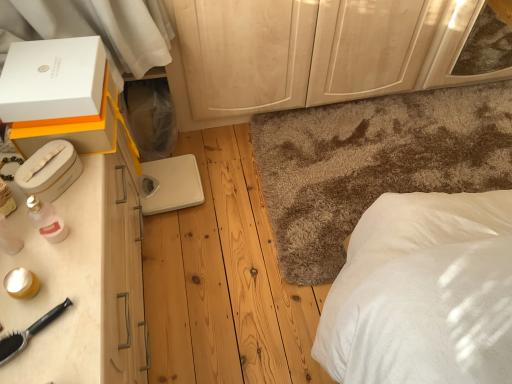
Question: Considering their positions, is white cardboard box at upper left, which is counted as the 2th box, starting from the top, located in front of or behind white matte box at upper left, which appears as the first box when viewed from the top?

Choices:
 (A) front
 (B) behind

Answer: (B)

Question: Is white cardboard box at upper left, which is counted as the 2th box, starting from the top, inside or outside of white matte box at upper left, which appears as the first box when viewed from the top?

Choices:
 (A) inside
 (B) outside

Answer: (B)

Question: Which object is positioned closest to the white plastic scale at center?

Choices:
 (A) white matte box at upper left, which ranks as the 3th box in bottom-to-top order
 (B) white plastic box at left, marked as the 1th box in a bottom-to-top arrangement
 (C) shaggy carpet at center
 (D) white cardboard box at upper left, the 2th box ordered from the bottom
 (E) pink glass perfume at left

Answer: (D)

Question: Estimate the real-world distances between objects in this image. Which object is closer to the light wood dresser at center?

Choices:
 (A) black plastic brush at lower left
 (B) pink glass perfume at left
 (C) shaggy carpet at center
 (D) white matte box at upper left, which ranks as the 3th box in bottom-to-top order
 (E) white plastic scale at center

Answer: (C)